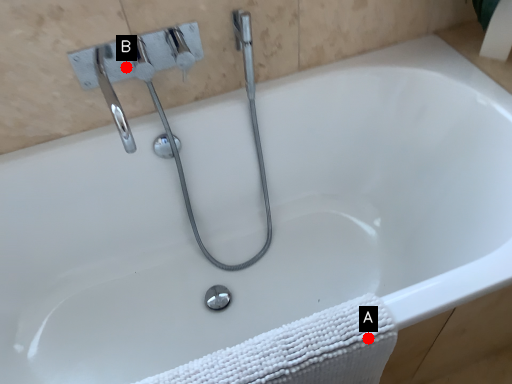
Question: Two points are circled on the image, labeled by A and B beside each circle. Which point is further to the camera?

Choices:
 (A) A is further
 (B) B is further

Answer: (B)